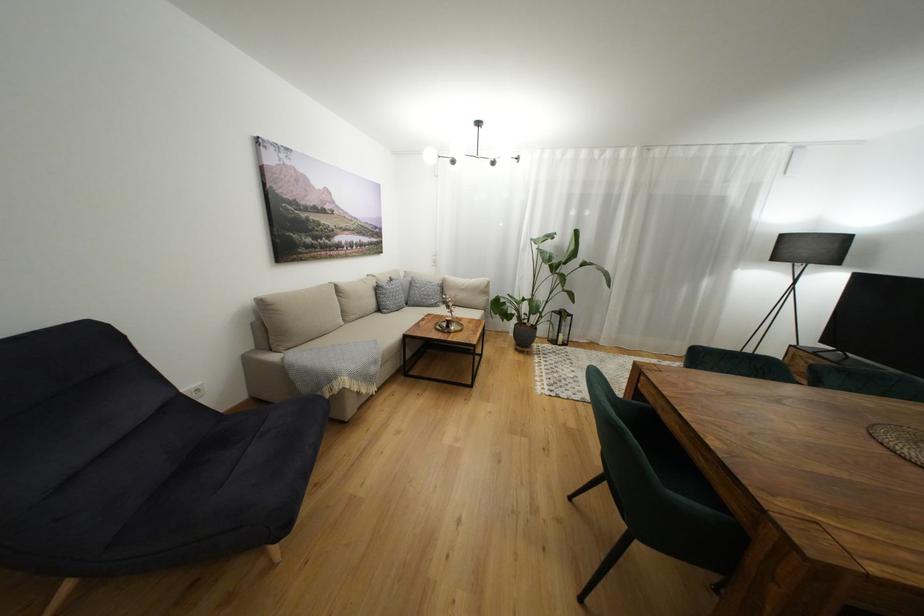
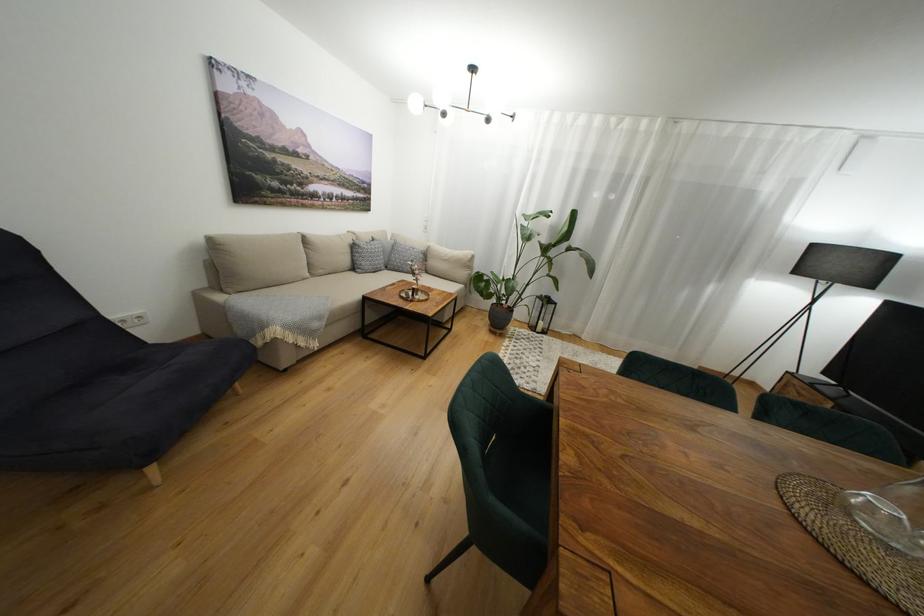
Question: The first image is from the beginning of the video and the second image is from the end. How did the camera likely rotate when shooting the video?

Choices:
 (A) Left
 (B) Right
 (C) Up
 (D) Down

Answer: (D)